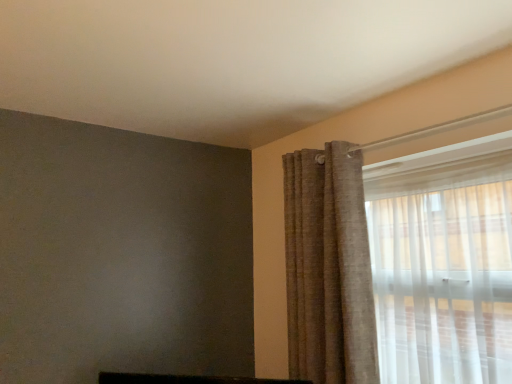
The height and width of the screenshot is (384, 512). Describe the element at coordinates (328, 268) in the screenshot. I see `textured beige curtain at upper right` at that location.

In order to face textured beige curtain at upper right, should I rotate leftwards or rightwards?

It's best to rotate right around 9.383 degrees.

You are a GUI agent. You are given a task and a screenshot of the screen. Output one action in this format:
    pyautogui.click(x=<x>, y=<y>)
    Task: Click on the textured beige curtain at upper right
    
    Given the screenshot: What is the action you would take?
    pyautogui.click(x=328, y=268)

Identify the location of textured beige curtain at upper right. (328, 268).